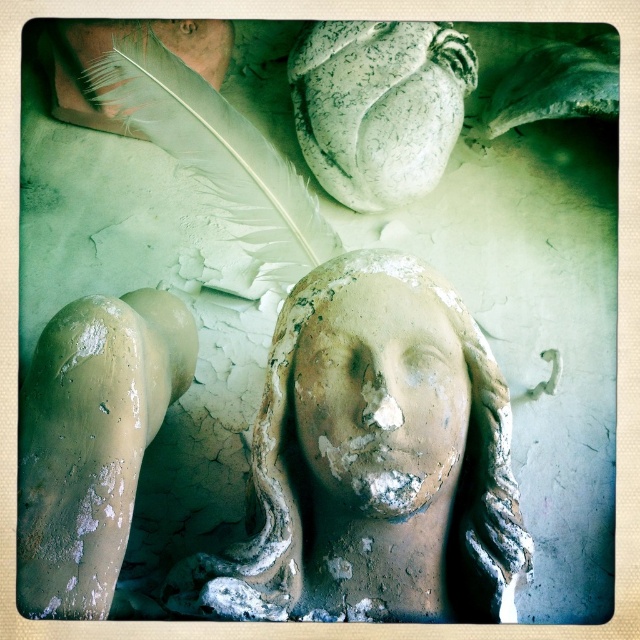
Question: Which object is farther from the camera taking this photo?

Choices:
 (A) matte clay face at center
 (B) matte clay head at center

Answer: (A)

Question: Does matte clay head at center have a greater width compared to matte clay face at center?

Choices:
 (A) no
 (B) yes

Answer: (B)

Question: From the image, what is the correct spatial relationship of matte clay head at center in relation to matte clay face at center?

Choices:
 (A) left
 (B) right

Answer: (A)

Question: Which of the following is the farthest from the observer?

Choices:
 (A) matte clay head at center
 (B) matte clay face at center

Answer: (B)

Question: Which object is farther from the camera taking this photo?

Choices:
 (A) matte clay head at center
 (B) matte clay face at center

Answer: (B)

Question: Can you confirm if matte clay head at center is positioned to the left of matte clay face at center?

Choices:
 (A) no
 (B) yes

Answer: (B)